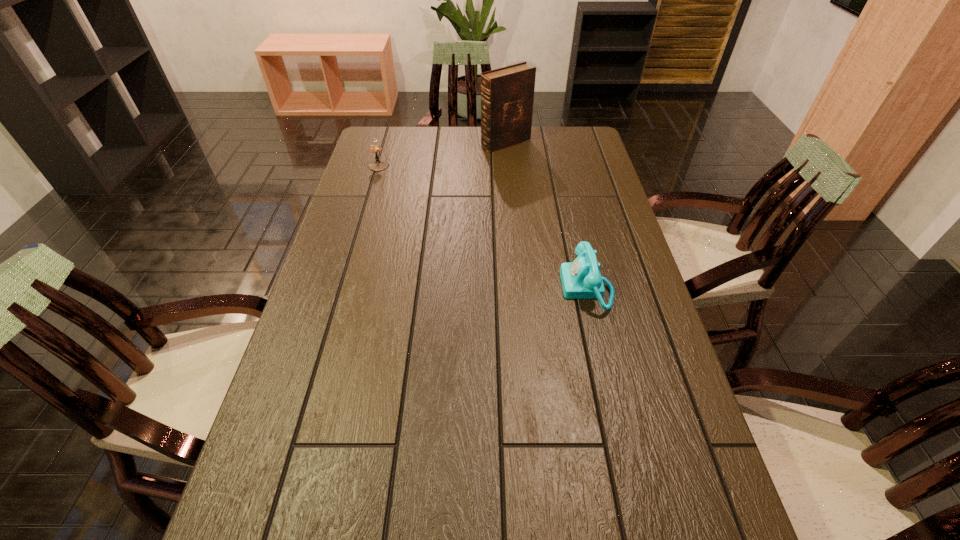
You are a GUI agent. You are given a task and a screenshot of the screen. Output one action in this format:
    pyautogui.click(x=<x>, y=<y>)
    Task: Click on the vacant region located on the dial of the telephone
    Image resolution: width=960 pixels, height=540 pixels.
    Given the screenshot: What is the action you would take?
    pyautogui.click(x=425, y=288)

This screenshot has height=540, width=960. What are the coordinates of `object located in the far edge section of the desktop` in the screenshot? It's located at (507, 94).

Locate an element on the screen. The height and width of the screenshot is (540, 960). object positioned at the left edge is located at coordinates (378, 165).

What are the coordinates of `object positioned at the right edge` in the screenshot? It's located at (581, 279).

In order to click on vacant space at the far edge of the desktop in this screenshot , I will do `click(465, 152)`.

Identify the location of vacant space at the left edge of the desktop. (352, 259).

Locate an element on the screen. The image size is (960, 540). free location at the right edge of the desktop is located at coordinates (586, 167).

This screenshot has width=960, height=540. What are the coordinates of `free region at the far right corner` in the screenshot? It's located at (562, 127).

Locate an element on the screen. This screenshot has width=960, height=540. vacant region between the Bible and the second farthest object is located at coordinates (443, 154).

The height and width of the screenshot is (540, 960). Identify the location of free space between the leftmost object and the telephone. (483, 227).